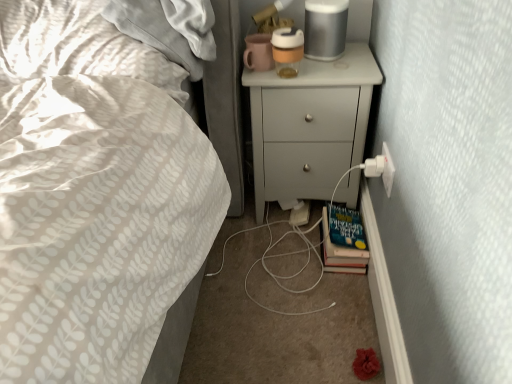
Question: Is white plastic electric outlet at lower right situated inside hardcover book at lower right or outside?

Choices:
 (A) inside
 (B) outside

Answer: (B)

Question: Considering the positions of white plastic electric outlet at lower right and hardcover book at lower right in the image, is white plastic electric outlet at lower right wider or thinner than hardcover book at lower right?

Choices:
 (A) wide
 (B) thin

Answer: (B)

Question: Based on their relative distances, which object is nearer to the white plastic electric outlet at lower right?

Choices:
 (A) hardcover book at lower right
 (B) white matte chest of drawers at upper right

Answer: (A)

Question: Estimate the real-world distances between objects in this image. Which object is closer to the white matte chest of drawers at upper right?

Choices:
 (A) white plastic electric outlet at lower right
 (B) hardcover book at lower right

Answer: (B)